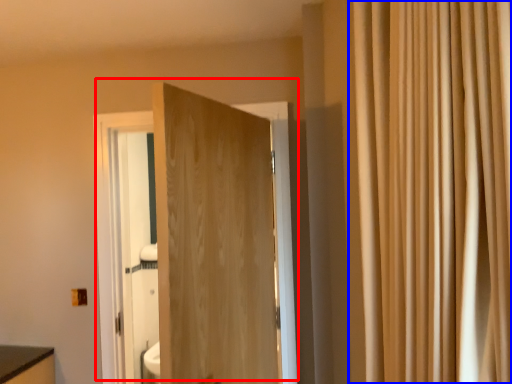
Question: Which of the following is the farthest to the observer, door (highlighted by a red box) or curtain (highlighted by a blue box)?

Choices:
 (A) door
 (B) curtain

Answer: (A)